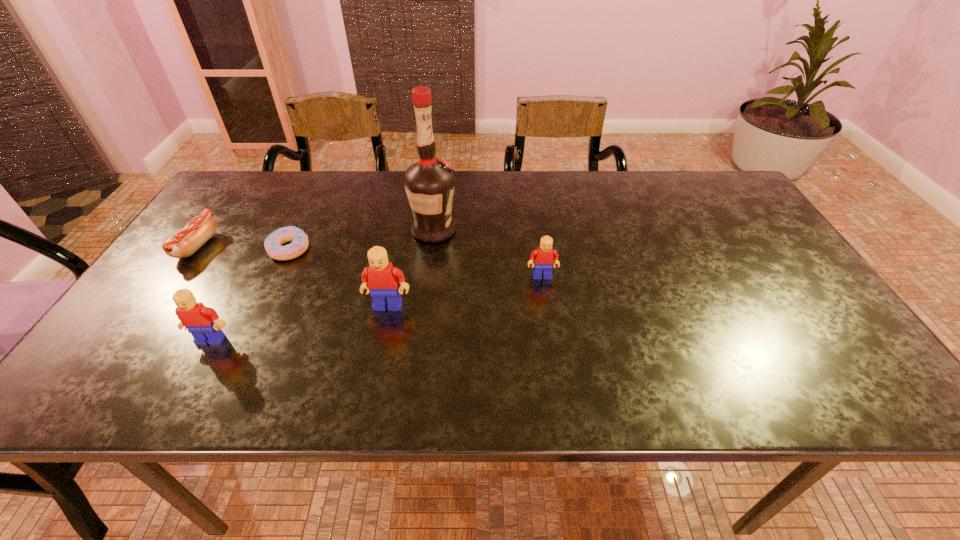
The Legos are evenly distributed in the image. To maintain this, where would you place another Lego on the right? Please point to a free space. Please provide its 2D coordinates. Your answer should be formatted as a tuple, i.e. [(x, y)], where the tuple contains the x and y coordinates of a point satisfying the conditions above.

[(678, 250)]